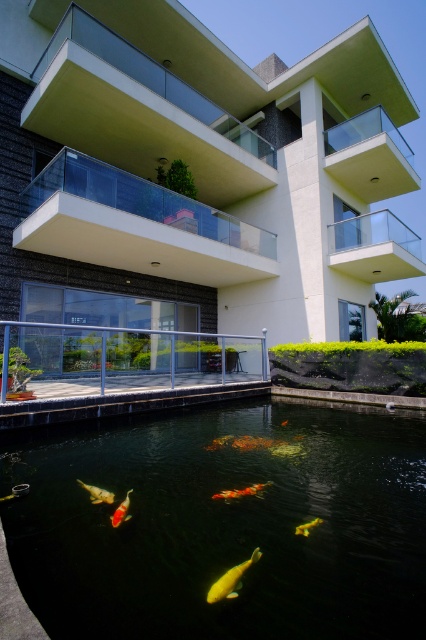
Question: Which point is farther from the camera taking this photo?

Choices:
 (A) (201, 614)
 (B) (374, 198)
 (C) (120, 509)

Answer: (B)

Question: Which point appears closest to the camera in this image?

Choices:
 (A) (221, 493)
 (B) (135, 211)
 (C) (95, 492)

Answer: (C)

Question: Which object is farther from the camera taking this photo?

Choices:
 (A) yellow shiny fish at center
 (B) shiny gold fish at center
 (C) transparent glass balcony at upper center

Answer: (C)

Question: Can you confirm if clear glass balcony at center is positioned below shiny orange fish at lower center?

Choices:
 (A) no
 (B) yes

Answer: (A)

Question: Does transparent glass balcony at upper right appear on the right side of clear glass balcony at upper right?

Choices:
 (A) no
 (B) yes

Answer: (B)

Question: Is clear glass balcony at upper right to the right of shiny gold fish at center from the viewer's perspective?

Choices:
 (A) no
 (B) yes

Answer: (B)